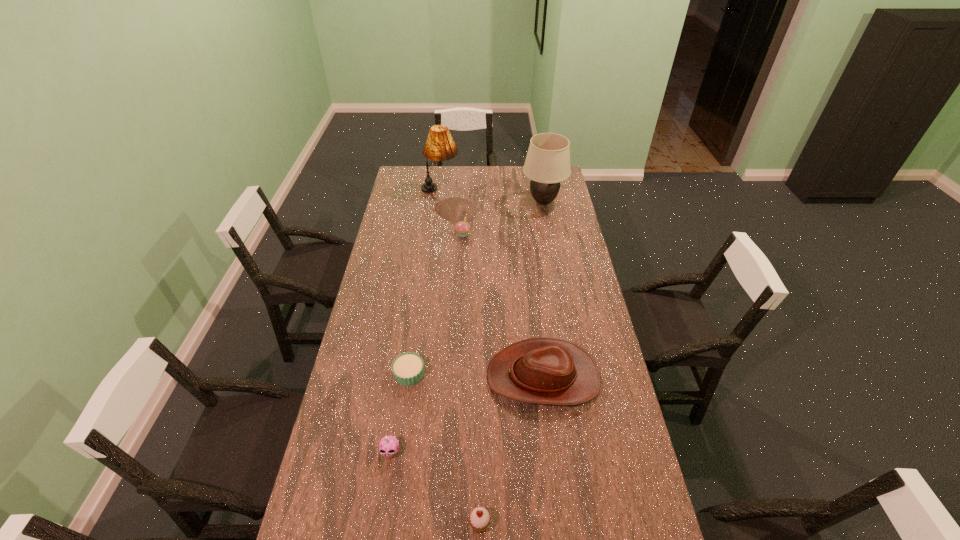
Where is `cupcake that stands as the closest to the rightmost cupcake`? This screenshot has width=960, height=540. cupcake that stands as the closest to the rightmost cupcake is located at coordinates (388, 447).

Identify the location of the closest cupcake to the rightmost cupcake. This screenshot has height=540, width=960. (388, 447).

At what (x,y) coordinates should I click in order to perform the action: click on free space that satisfies the following two spatial constraints: 1. on the front-facing side of the cowboy hat; 2. on the face of the sixth farthest object. Please return your answer as a coordinate pair (x, y). The image size is (960, 540). Looking at the image, I should click on (552, 453).

Identify the location of vacant space that satisfies the following two spatial constraints: 1. on the front-facing side of the left lampshade; 2. on the face of the second nearest object. The height and width of the screenshot is (540, 960). (408, 453).

Locate an element on the screen. vacant area in the image that satisfies the following two spatial constraints: 1. on the face of the rightmost cupcake; 2. on the left side of the third farthest cupcake is located at coordinates (379, 524).

Identify the location of free location that satisfies the following two spatial constraints: 1. on the front-facing side of the left lampshade; 2. on the right side of the nearest object. This screenshot has width=960, height=540. (399, 524).

Identify the location of free space that satisfies the following two spatial constraints: 1. on the back side of the farthest cupcake; 2. on the left side of the shortest object. (429, 234).